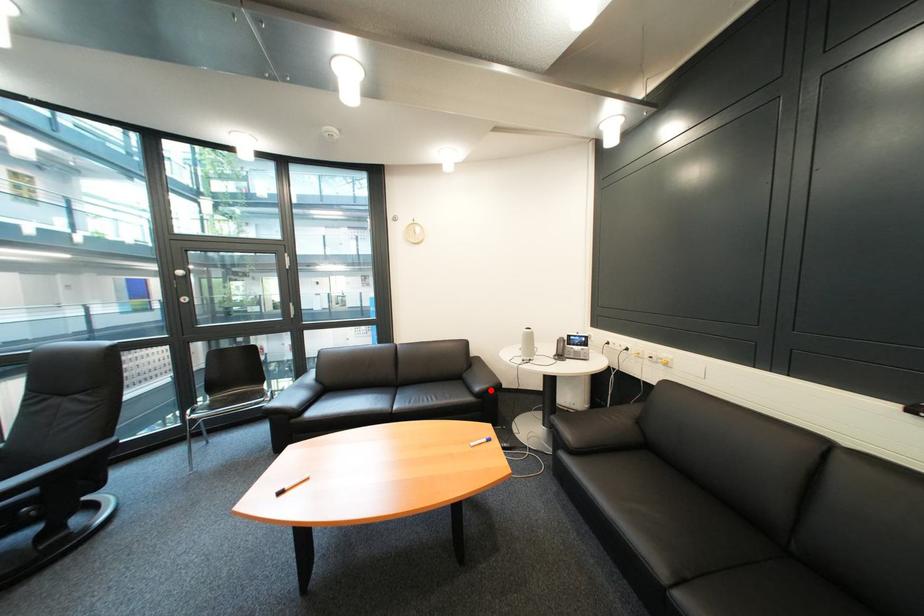
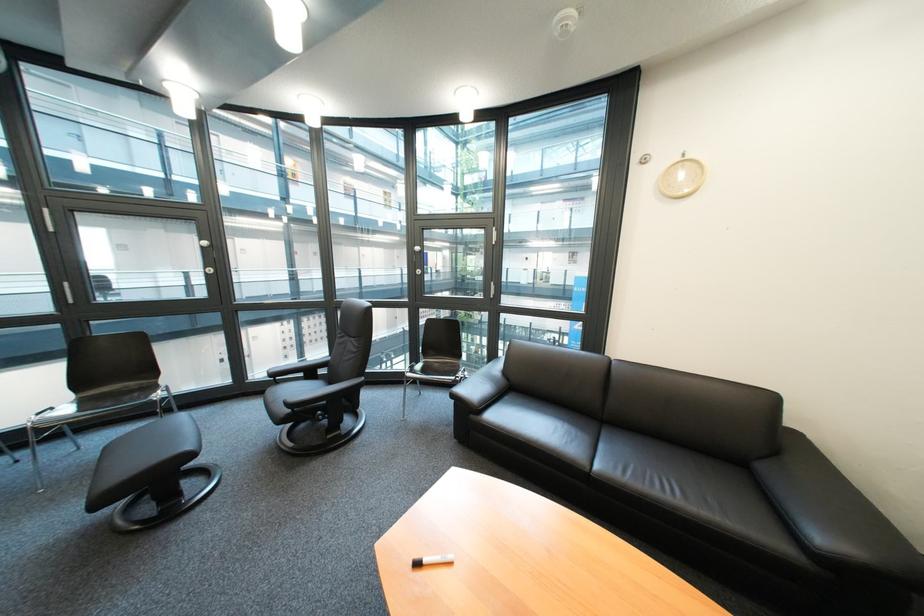
In the second image, find the point that corresponds to the highlighted location in the first image.

(833, 540)